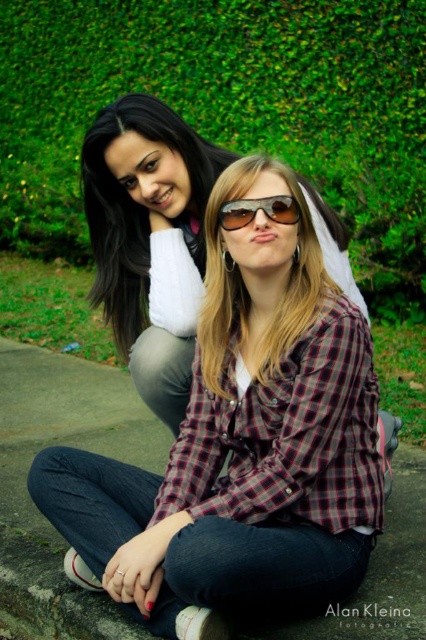
Is green leafy hedge at upper center shorter than plaid shirt at center?

Incorrect, green leafy hedge at upper center's height does not fall short of plaid shirt at center's.

Is green leafy hedge at upper center bigger than plaid shirt at center?

Correct, green leafy hedge at upper center is larger in size than plaid shirt at center.

Does point (181, 113) lie in front of point (169, 276)?

No, it is behind (169, 276).

Image resolution: width=426 pixels, height=640 pixels. I want to click on green leafy hedge at upper center, so click(x=227, y=109).

Is green leafy hedge at upper center wider than sunglasses at center?

Correct, the width of green leafy hedge at upper center exceeds that of sunglasses at center.

Does green leafy hedge at upper center appear on the right side of sunglasses at center?

In fact, green leafy hedge at upper center is to the left of sunglasses at center.

Does point (422, 3) lie behind point (250, 212)?

Yes, it is behind point (250, 212).

Find the location of a particular element. This screenshot has width=426, height=640. green leafy hedge at upper center is located at coordinates (227, 109).

Who is positioned more to the left, plaid fabric shirt at center or green leafy hedge at upper center?

Positioned to the left is green leafy hedge at upper center.

Who is lower down, plaid fabric shirt at center or green leafy hedge at upper center?

plaid fabric shirt at center is lower down.

What do you see at coordinates (242, 444) in the screenshot?
I see `plaid fabric shirt at center` at bounding box center [242, 444].

The image size is (426, 640). I want to click on plaid fabric shirt at center, so click(x=242, y=444).